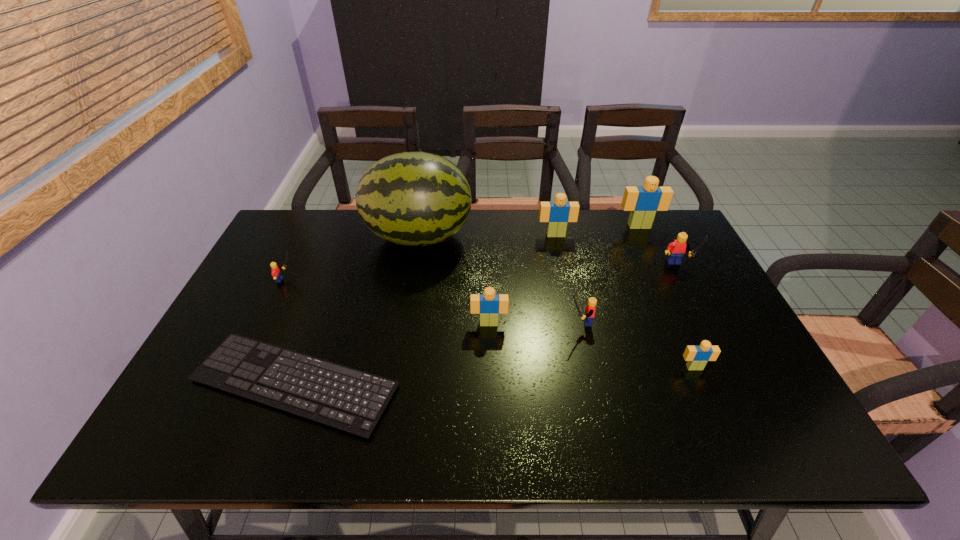
Identify the location of the nearest yellow Lego. This screenshot has height=540, width=960. (590, 308).

I want to click on the leftmost Lego, so click(x=276, y=273).

The image size is (960, 540). Find the location of `the smallest yellow Lego`. the smallest yellow Lego is located at coordinates (276, 273).

Identify the location of the smallest beige Lego. This screenshot has width=960, height=540. (697, 357).

Identify the location of the nearest Lego. Image resolution: width=960 pixels, height=540 pixels. (697, 357).

At what (x,y) coordinates should I click in order to perform the action: click on the shortest object. Please return your answer as a coordinate pair (x, y). Looking at the image, I should click on (345, 398).

Locate an element on the screen. This screenshot has width=960, height=540. black computer keyboard is located at coordinates (345, 398).

I want to click on vacant point located at the stem end of the tallest object, so click(510, 237).

Image resolution: width=960 pixels, height=540 pixels. Identify the location of blank area located on the face of the farthest beige Lego. (655, 261).

The height and width of the screenshot is (540, 960). In order to click on free space located on the face of the third beige Lego from right to left in this screenshot , I will do `click(563, 267)`.